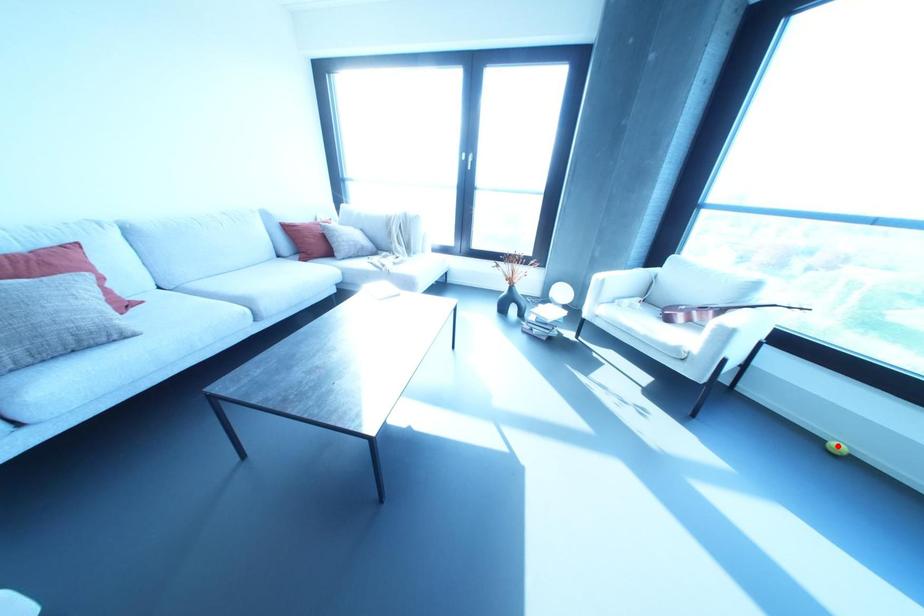
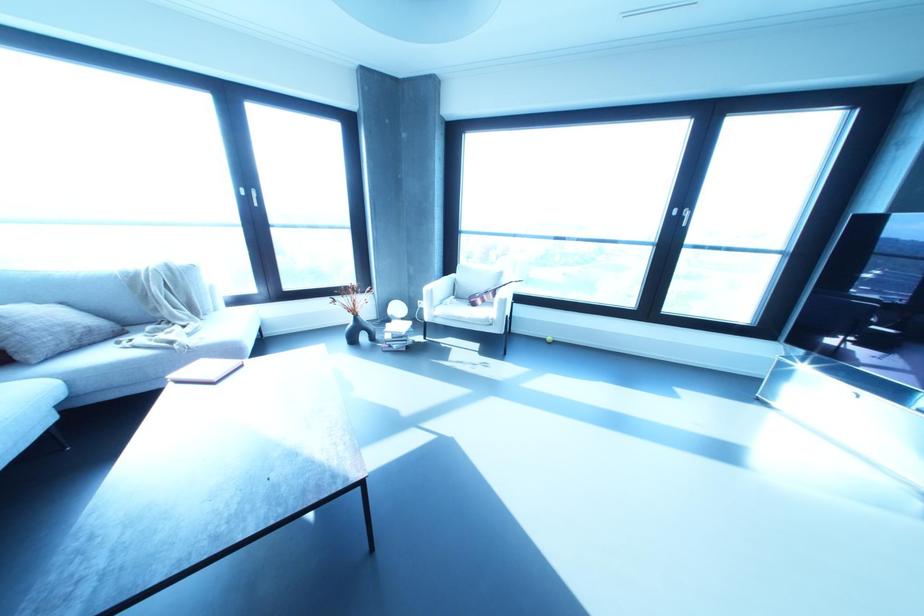
Question: A red point is marked in image1. In image2, is the corresponding 3D point closer to the camera or farther? Reply with the corresponding letter.

Choices:
 (A) The corresponding 3D point is closer.
 (B) The corresponding 3D point is farther.

Answer: (A)